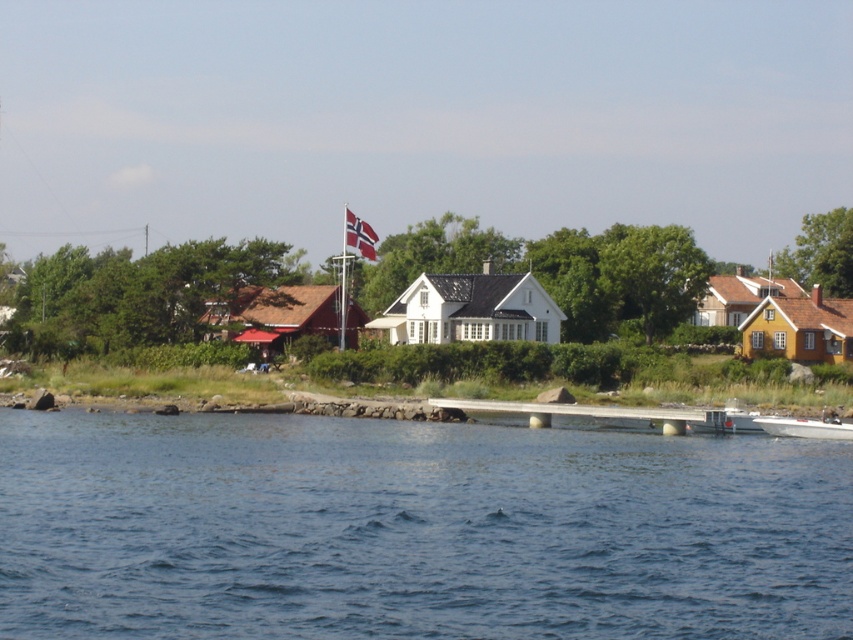
You are standing on the pier and want to fly a kite. You notice the white fabric flag at upper center and the white plastic boat at lower right. Which object is higher from the ground?

The white fabric flag at upper center is higher than the white plastic boat at lower right because the white plastic boat at lower right is below the white fabric flag at upper center.

You are a tourist standing at the end of the small pier and want to take a photo of the white plastic boat at lower right and the white fabric flag at upper center in the same frame. Given their distance apart, will you be able to capture both in your camera view without moving your position?

The white plastic boat at lower right is 282.93 feet away from the white fabric flag at upper center. Since the distance between them is quite large, it might be challenging to capture both in the same frame without adjusting your camera or moving your position. However, using a wide angle lens could help include both in the photo.